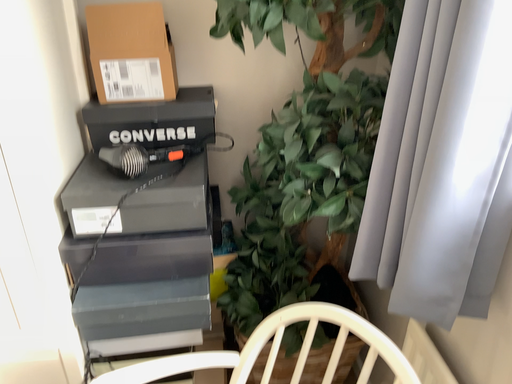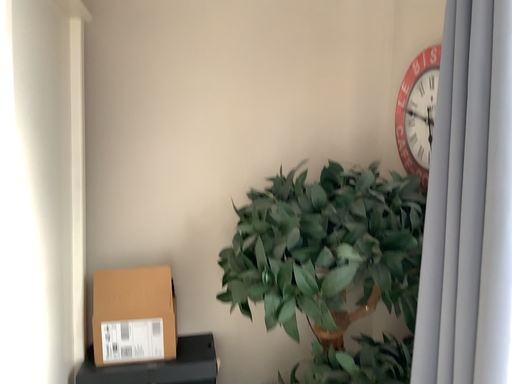
Question: Which way did the camera rotate in the video?

Choices:
 (A) rotated upward
 (B) rotated downward

Answer: (A)